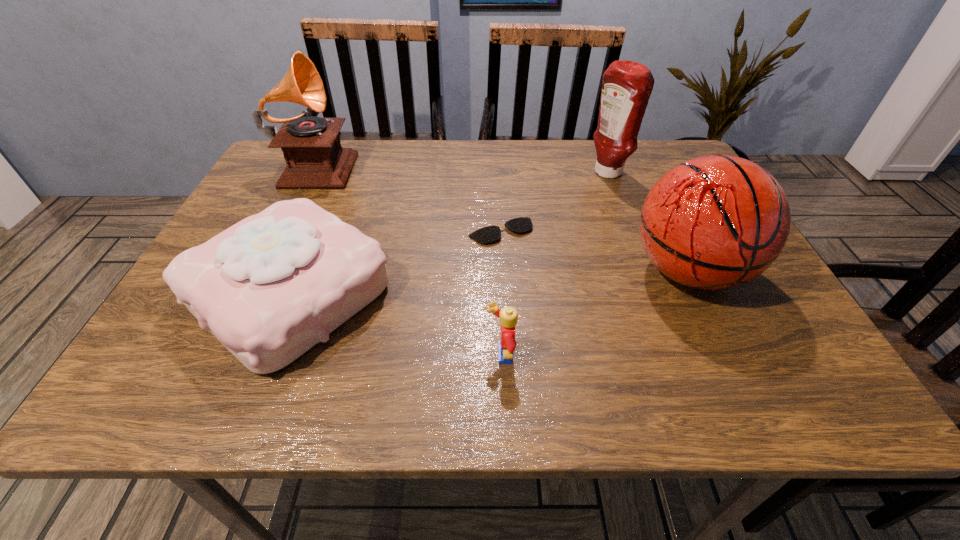
What are the coordinates of `object situated at the right edge` in the screenshot? It's located at (714, 222).

Find the location of a particular element. object at the far left corner is located at coordinates (311, 146).

Find the location of `object that is at the near left corner`. object that is at the near left corner is located at coordinates [270, 287].

I want to click on blank space at the far edge of the desktop, so click(401, 179).

Locate an element on the screen. This screenshot has width=960, height=540. vacant space at the near edge of the desktop is located at coordinates (280, 385).

At what (x,y) coordinates should I click in order to perform the action: click on vacant space at the left edge of the desktop. Please return your answer as a coordinate pair (x, y). This screenshot has width=960, height=540. Looking at the image, I should click on (180, 315).

Find the location of a particular element. blank space at the right edge of the desktop is located at coordinates (776, 350).

In the image, there is a desktop. At what (x,y) coordinates should I click in order to perform the action: click on vacant space at the near right corner. Please return your answer as a coordinate pair (x, y). Looking at the image, I should click on 764,383.

The height and width of the screenshot is (540, 960). Find the location of `vacant space that is in between the cake and the condiment`. vacant space that is in between the cake and the condiment is located at coordinates (448, 233).

Identify the location of empty space that is in between the spectacles and the cake. (396, 262).